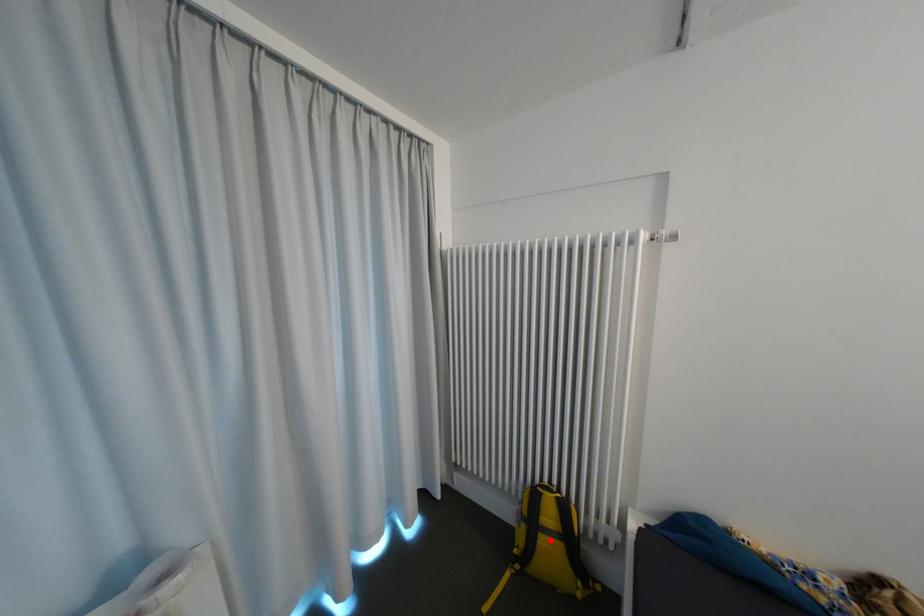
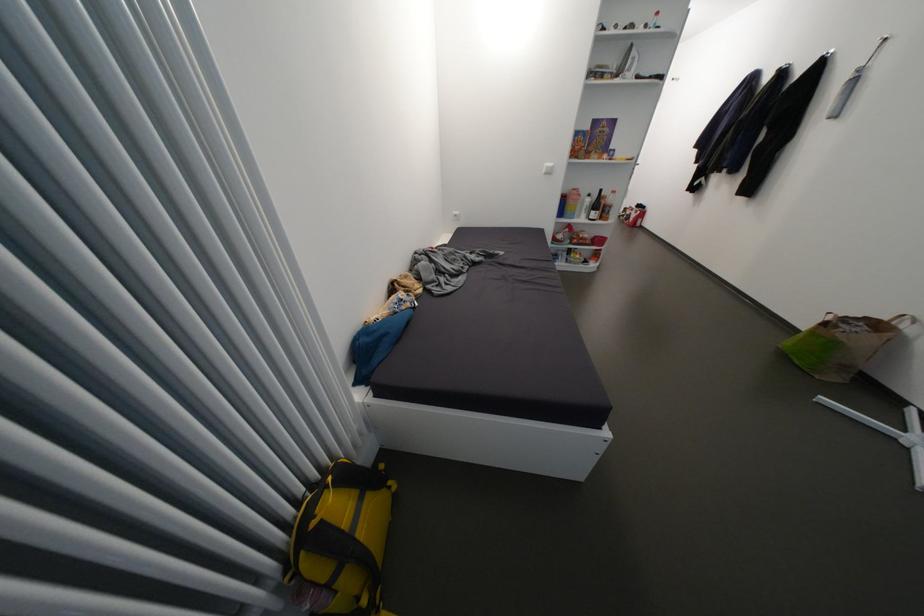
Question: I am providing you with two images of the same scene from different viewpoints. Given a red point in image1, look at the same physical point in image2. Is it:

Choices:
 (A) Closer to the viewpoint
 (B) Farther from the viewpoint

Answer: (A)